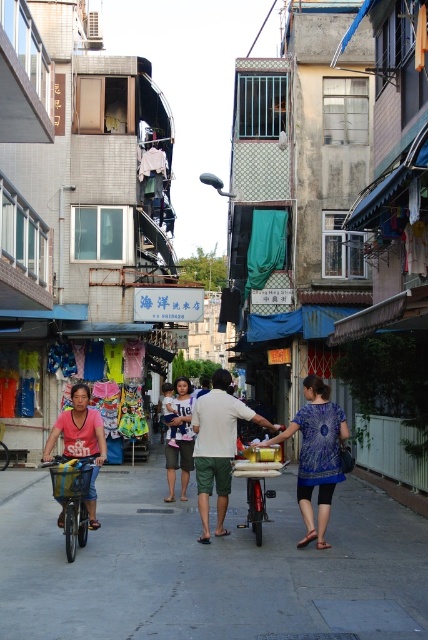
You are standing at the entrance of the alley and see a woman in a pink matte shirt at left and a person in blue denim shorts at center. Which of the two is closer to you?

The pink matte shirt at left is 14.03 feet away from blue denim shorts at center, so the blue denim shorts at center is closer to you.

You are a delivery person needing to pass between the metallic silver bicycle at center and the blue denim shorts at center. The delivery cart you are pushing is 1.2 meters wide. Can you fit through the space between them?

The metallic silver bicycle at center and blue denim shorts at center are 3.82 meters apart from each other. Since the delivery cart is only 1.2 meters wide, there is more than enough space to pass through the gap between them.